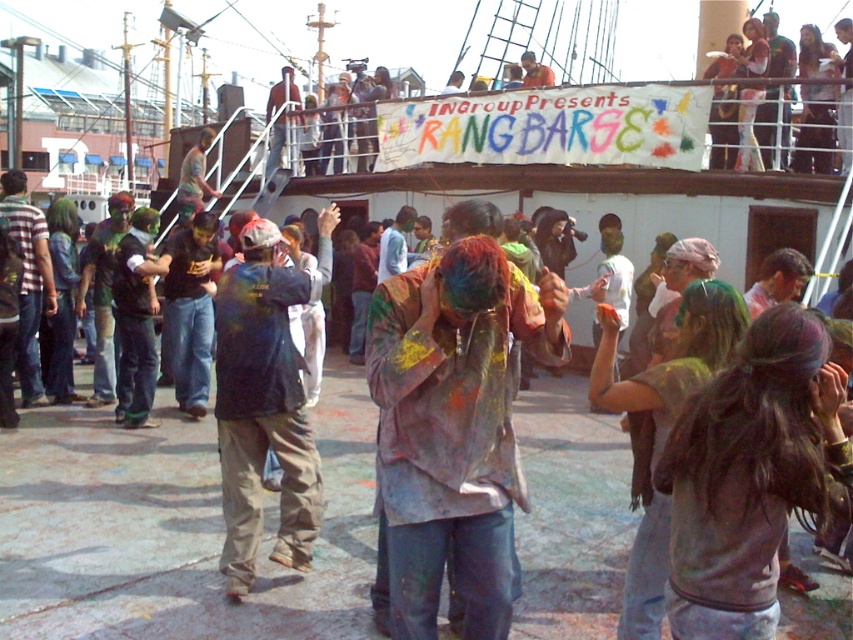
You are a photographer at the Holi festival event. You need to capture a photo that includes both the striped shirt at left and the matte black shirt at upper right. Which shirt should you zoom in on to ensure both are clearly visible in the frame?

You should zoom in on the striped shirt at left because it is bigger than the matte black shirt at upper right, making it easier to include both in the frame without losing detail on the smaller one.

Based on the photo, you are a photographer at the Holi festival on the ship deck. You want to capture a photo where both the matte black shirt at upper right and the matte black shirt at center are clearly visible. Which shirt should you focus on to ensure both are in frame?

The matte black shirt at upper right occupies less space than the matte black shirt at center, so focusing on the matte black shirt at center would allow both to be in frame as it takes up more space and is likely closer to the center of the image.